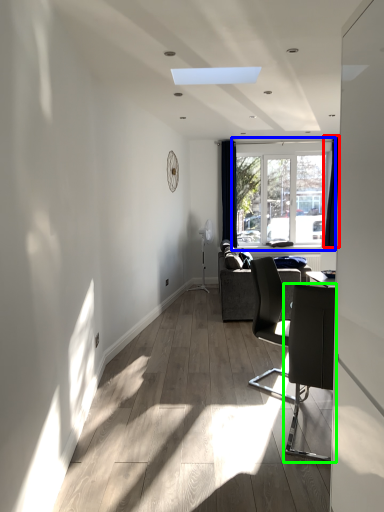
Question: Which is nearer to the curtain (highlighted by a red box)? window (highlighted by a blue box) or chair (highlighted by a green box).

Choices:
 (A) window
 (B) chair

Answer: (A)